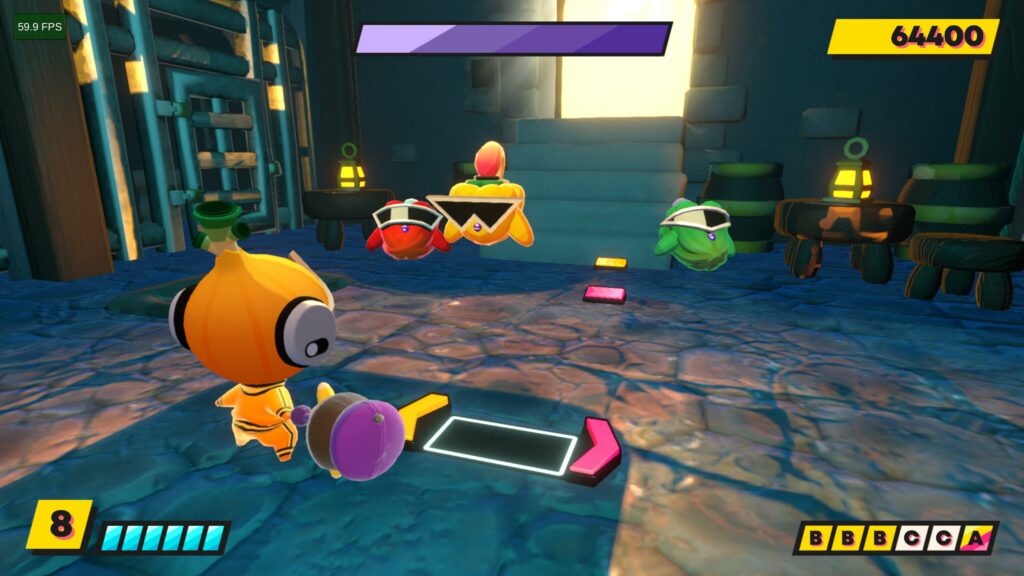
The image size is (1024, 576). What are the coordinates of `lamp` in the screenshot? It's located at (843, 190).